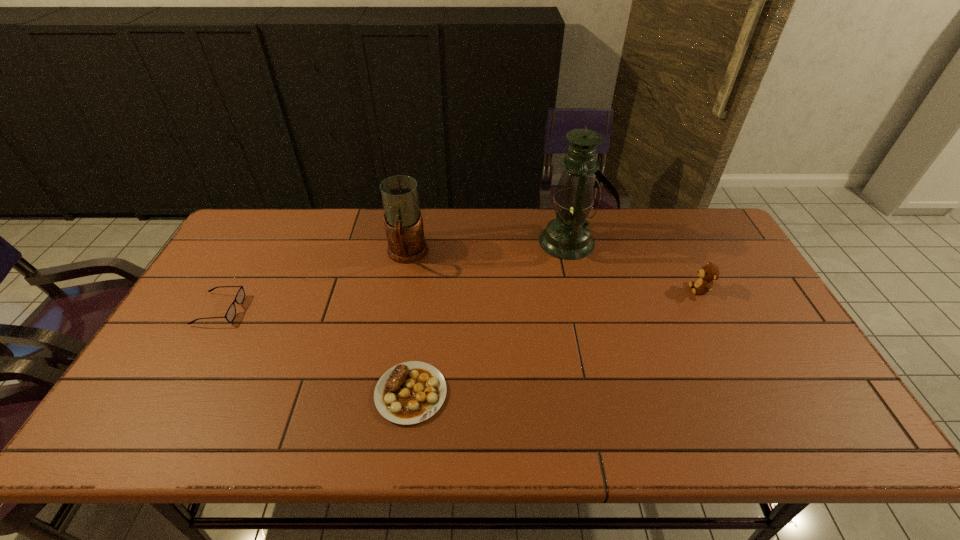
The height and width of the screenshot is (540, 960). In the image, there is a desktop. What are the coordinates of `blank space at the far edge` in the screenshot? It's located at (335, 241).

The height and width of the screenshot is (540, 960). In the image, there is a desktop. Identify the location of vacant area at the near edge. (325, 416).

What are the coordinates of `vacant region at the left edge of the desktop` in the screenshot? It's located at (205, 370).

At what (x,y) coordinates should I click in order to perform the action: click on free space at the far left corner of the desktop. Please return your answer as a coordinate pair (x, y). This screenshot has width=960, height=540. Looking at the image, I should click on (276, 214).

In the image, there is a desktop. Where is `vacant space at the near left corner`? The height and width of the screenshot is (540, 960). vacant space at the near left corner is located at coordinates (159, 413).

I want to click on vacant region at the far right corner, so click(x=723, y=240).

Where is `unoccupied area between the oil lamp and the leftmost object`? unoccupied area between the oil lamp and the leftmost object is located at coordinates 393,275.

Locate an element on the screen. free space that is in between the steak and the fourth shortest object is located at coordinates (409, 324).

Identify the location of free space between the shortest object and the spectacles. This screenshot has width=960, height=540. (315, 351).

Where is `free space between the fourth shortest object and the spectacles`? free space between the fourth shortest object and the spectacles is located at coordinates tap(313, 282).